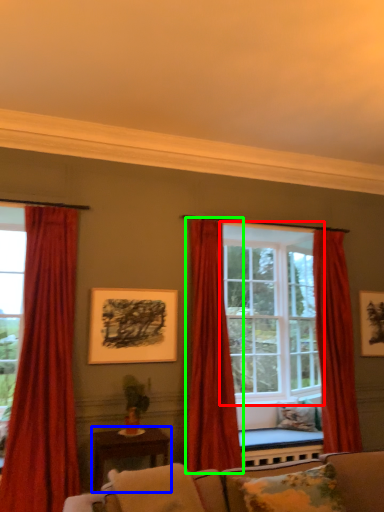
Question: Which object is positioned farthest from window (highlighted by a red box)? Select from table (highlighted by a blue box) and curtain (highlighted by a green box).

Choices:
 (A) table
 (B) curtain

Answer: (A)